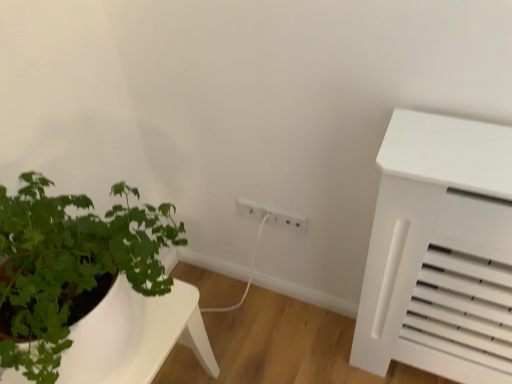
Question: Is the depth of white matte table at lower left greater than that of white plastic electric outlet at center, which appears as the 1th electric outlet when viewed from the left?

Choices:
 (A) no
 (B) yes

Answer: (A)

Question: Would you say white matte table at lower left contains white plastic electric outlet at center, which appears as the 2th electric outlet when viewed from the right?

Choices:
 (A) no
 (B) yes

Answer: (A)

Question: Does white matte table at lower left turn towards white plastic electric outlet at center, which appears as the 2th electric outlet when viewed from the right?

Choices:
 (A) no
 (B) yes

Answer: (A)

Question: From a real-world perspective, is white matte table at lower left positioned over white plastic electric outlet at center, which appears as the 1th electric outlet when viewed from the left, based on gravity?

Choices:
 (A) no
 (B) yes

Answer: (A)

Question: Is the position of white matte table at lower left less distant than that of white plastic electric outlet at center, which appears as the 1th electric outlet when viewed from the left?

Choices:
 (A) yes
 (B) no

Answer: (A)

Question: From the image's perspective, is white plastic electric outlet at center, which appears as the 1th electric outlet when viewed from the left, above or below white plastic electric outlet at center, acting as the 2th electric outlet starting from the left?

Choices:
 (A) above
 (B) below

Answer: (B)

Question: In the image, is white plastic electric outlet at center, which appears as the 2th electric outlet when viewed from the right, on the left side or the right side of white plastic electric outlet at center, placed as the first electric outlet when sorted from right to left?

Choices:
 (A) right
 (B) left

Answer: (B)

Question: Does point [x=268, y=215] appear closer or farther from the camera than point [x=264, y=215]?

Choices:
 (A) farther
 (B) closer

Answer: (A)

Question: In terms of height, does white plastic electric outlet at center, which appears as the 2th electric outlet when viewed from the right, look taller or shorter compared to white plastic electric outlet at center, placed as the first electric outlet when sorted from right to left?

Choices:
 (A) short
 (B) tall

Answer: (A)

Question: Is white matte table at lower left spatially inside white plastic electric outlet at center, placed as the first electric outlet when sorted from right to left, or outside of it?

Choices:
 (A) inside
 (B) outside

Answer: (B)

Question: Considering the positions of white matte table at lower left and white plastic electric outlet at center, placed as the first electric outlet when sorted from right to left, in the image, is white matte table at lower left taller or shorter than white plastic electric outlet at center, placed as the first electric outlet when sorted from right to left,?

Choices:
 (A) short
 (B) tall

Answer: (B)

Question: Considering the positions of white matte table at lower left and white plastic electric outlet at center, placed as the first electric outlet when sorted from right to left, in the image, is white matte table at lower left wider or thinner than white plastic electric outlet at center, placed as the first electric outlet when sorted from right to left,?

Choices:
 (A) thin
 (B) wide

Answer: (B)

Question: Does point (137, 294) appear closer or farther from the camera than point (265, 210)?

Choices:
 (A) closer
 (B) farther

Answer: (A)

Question: Would you say white plastic electric outlet at center, placed as the first electric outlet when sorted from right to left, is inside or outside white matte table at lower left?

Choices:
 (A) inside
 (B) outside

Answer: (B)

Question: Would you say white plastic electric outlet at center, acting as the 2th electric outlet starting from the left, is to the left or to the right of white matte table at lower left in the picture?

Choices:
 (A) right
 (B) left

Answer: (A)